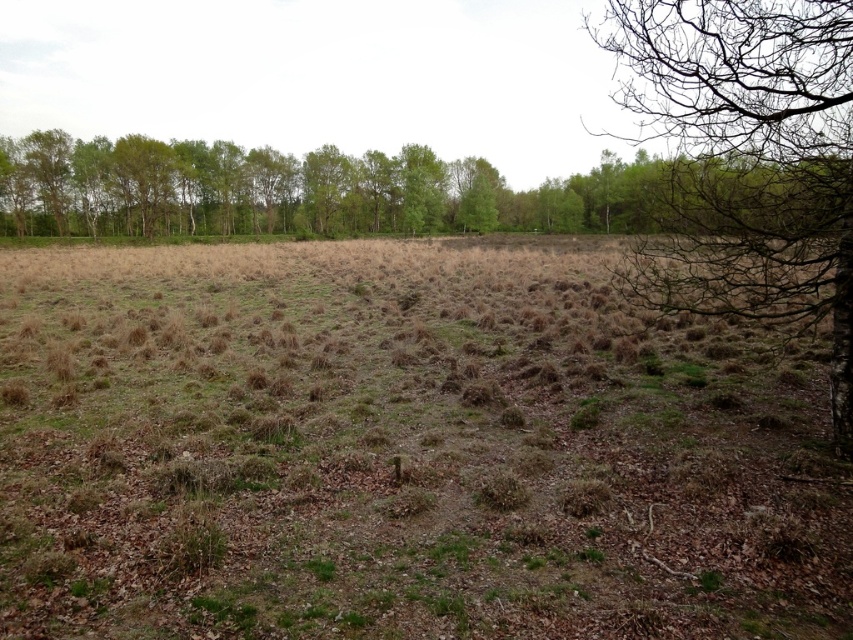
Is brown grassy field at center shorter than green leafy trees at upper center?

Yes, brown grassy field at center is shorter than green leafy trees at upper center.

Who is taller, brown grassy field at center or green leafy trees at upper center?

green leafy trees at upper center

Who is more distant from viewer, (494, 593) or (204, 196)?

Positioned behind is point (204, 196).

I want to click on brown grassy field at center, so 399,451.

Is the position of bare branches at right more distant than that of green leafy trees at upper center?

No, it is in front of green leafy trees at upper center.

Based on the photo, does bare branches at right have a lesser width compared to green leafy trees at upper center?

Yes.

Is point (680, 106) positioned in front of point (694, 186)?

Yes, point (680, 106) is in front of point (694, 186).

You are a GUI agent. You are given a task and a screenshot of the screen. Output one action in this format:
    pyautogui.click(x=<x>, y=<y>)
    Task: Click on the bare branches at right
    Image resolution: width=853 pixels, height=640 pixels.
    Given the screenshot: What is the action you would take?
    pyautogui.click(x=749, y=161)

Does brown grassy field at center lie in front of bare branches at right?

Yes, it is in front of bare branches at right.

Does brown grassy field at center lie behind bare branches at right?

No, brown grassy field at center is in front of bare branches at right.

You are a GUI agent. You are given a task and a screenshot of the screen. Output one action in this format:
    pyautogui.click(x=<x>, y=<y>)
    Task: Click on the brown grassy field at center
    The width and height of the screenshot is (853, 640).
    Given the screenshot: What is the action you would take?
    pyautogui.click(x=399, y=451)

Image resolution: width=853 pixels, height=640 pixels. Find the location of `brown grassy field at center`. brown grassy field at center is located at coordinates (399, 451).